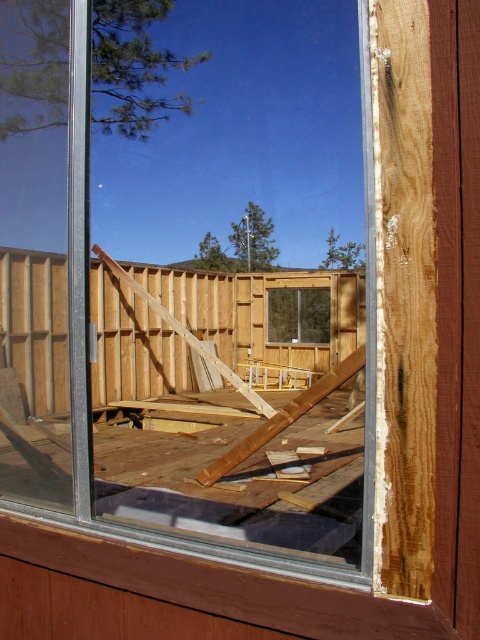
Consider the image. Which is above, transparent glass window at center or clear glass window at center?

transparent glass window at center is above.

Does point (195, 518) come in front of point (304, 333)?

Yes, it is in front of point (304, 333).

Find the location of a particular element. transparent glass window at center is located at coordinates (171, 307).